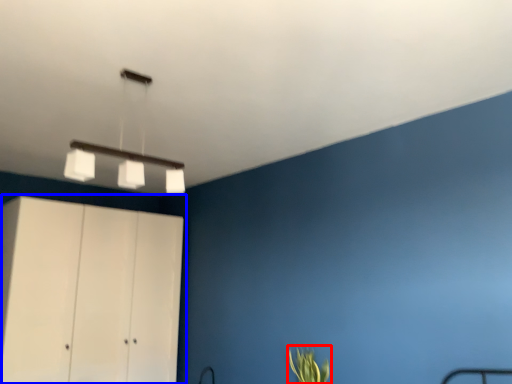
Question: Which object is further to the camera taking this photo, plant (highlighted by a red box) or cupboard (highlighted by a blue box)?

Choices:
 (A) plant
 (B) cupboard

Answer: (B)